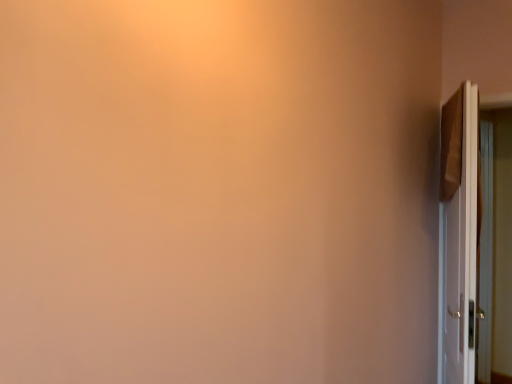
Where is `white glossy door at right`? This screenshot has height=384, width=512. white glossy door at right is located at coordinates 459,236.

The width and height of the screenshot is (512, 384). Describe the element at coordinates (459, 236) in the screenshot. I see `white glossy door at right` at that location.

Where is `white glossy door at right`? white glossy door at right is located at coordinates (459, 236).